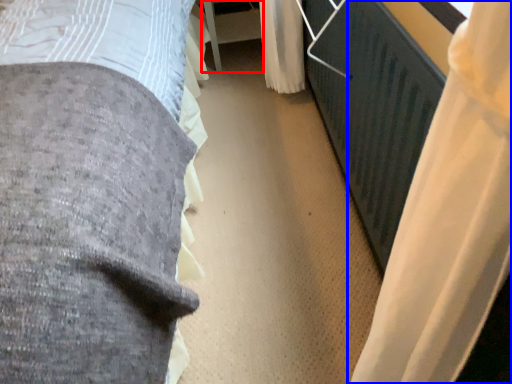
Question: Which of the following is the farthest to the observer, table (highlighted by a red box) or curtain (highlighted by a blue box)?

Choices:
 (A) table
 (B) curtain

Answer: (A)